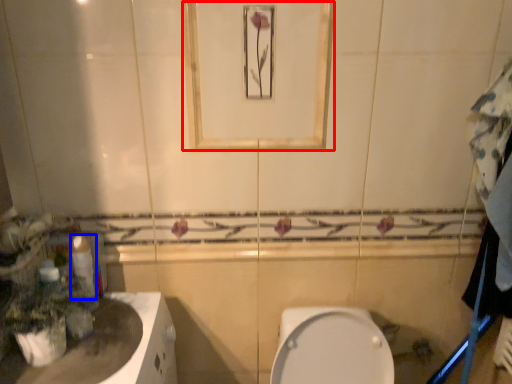
Question: Which point is closer to the camera, mirror (highlighted by a red box) or toilet paper (highlighted by a blue box)?

Choices:
 (A) mirror
 (B) toilet paper

Answer: (A)